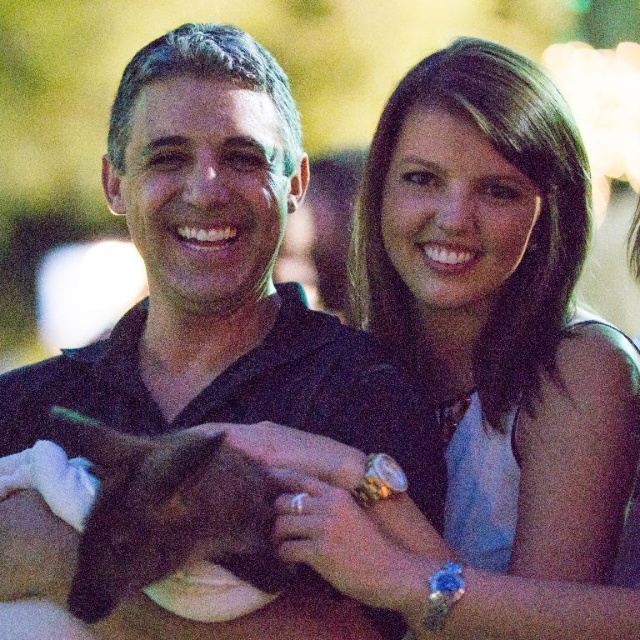
Question: Is black matte shirt at center positioned at the back of satin white dress at upper right?

Choices:
 (A) yes
 (B) no

Answer: (A)

Question: Can you confirm if black matte shirt at center is positioned above black fur cat at center?

Choices:
 (A) no
 (B) yes

Answer: (B)

Question: Which object is the farthest from the black matte shirt at center?

Choices:
 (A) satin white dress at upper right
 (B) black fur cat at center

Answer: (A)

Question: Which object is closer to the camera taking this photo?

Choices:
 (A) satin white dress at upper right
 (B) black matte shirt at center
 (C) black fur cat at center

Answer: (C)

Question: Among these objects, which one is farthest from the camera?

Choices:
 (A) black matte shirt at center
 (B) satin white dress at upper right
 (C) black fur cat at center

Answer: (A)

Question: Observing the image, what is the correct spatial positioning of satin white dress at upper right in reference to black fur cat at center?

Choices:
 (A) left
 (B) right

Answer: (B)